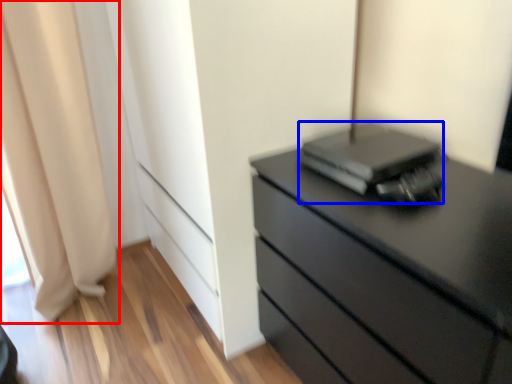
Question: Which point is closer to the camera, curtain (highlighted by a red box) or computer (highlighted by a blue box)?

Choices:
 (A) curtain
 (B) computer

Answer: (B)